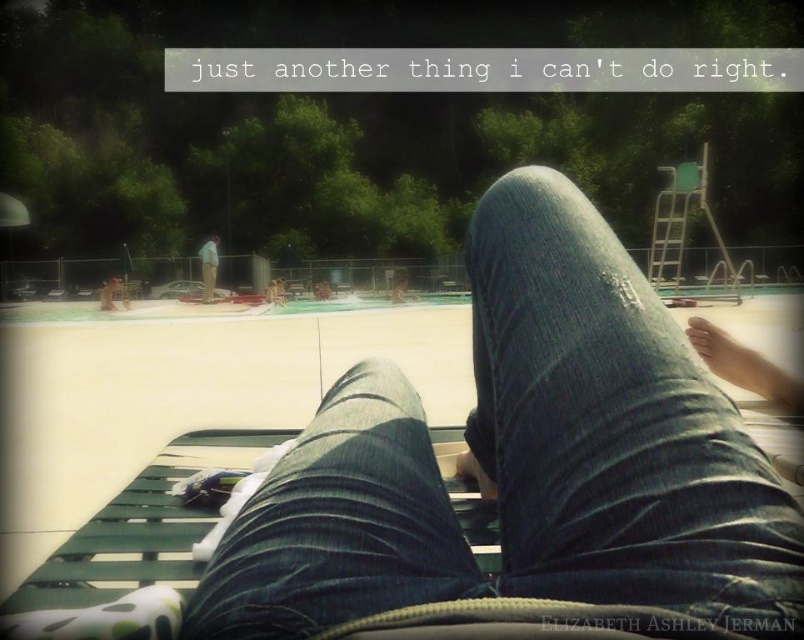
Question: Can you confirm if denim jeans at center is positioned to the right of smooth skin foot at lower right?

Choices:
 (A) no
 (B) yes

Answer: (A)

Question: Which object appears farthest from the camera in this image?

Choices:
 (A) smooth tan skin at center
 (B) denim jeans at center
 (C) light green fabric at center
 (D) smooth skin foot at lower right

Answer: (C)

Question: Which of the following is the farthest from the observer?

Choices:
 (A) smooth skin foot at lower right
 (B) smooth tan skin at center
 (C) light green fabric at center
 (D) denim jeans at center

Answer: (C)

Question: Which point is farther to the camera?

Choices:
 (A) (208, 284)
 (B) (405, 298)
 (C) (539, 474)

Answer: (A)

Question: Can you confirm if light green fabric at center is wider than smooth tan skin at center?

Choices:
 (A) no
 (B) yes

Answer: (A)

Question: Does smooth skin foot at lower right appear under light green fabric at center?

Choices:
 (A) no
 (B) yes

Answer: (B)